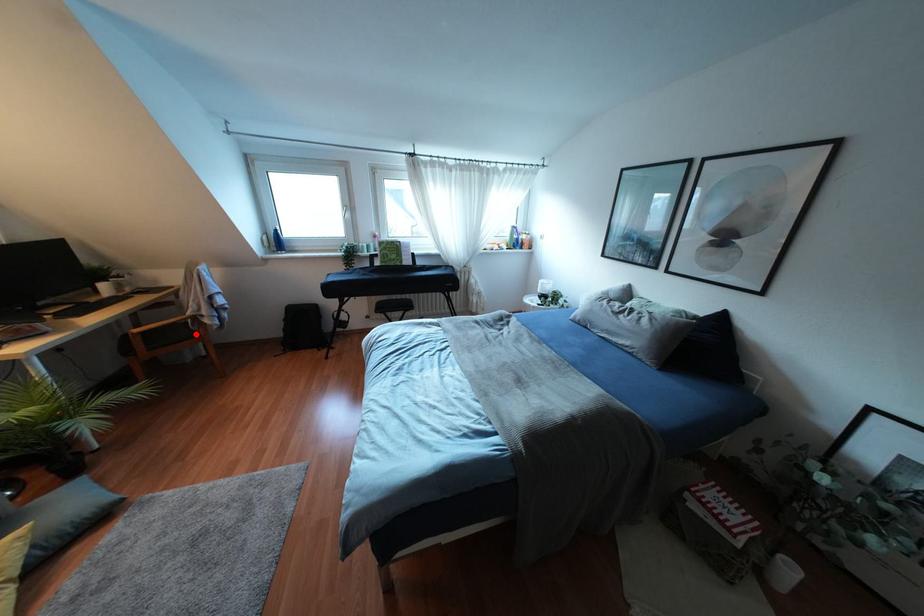
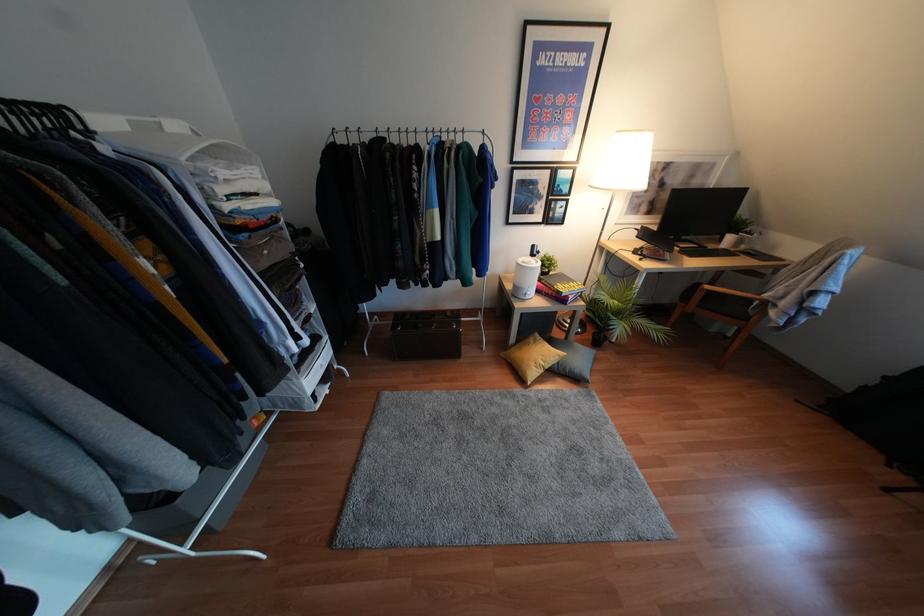
Question: I am providing you with two images of the same scene from different viewpoints. Image1 has a red point marked. In image2, the corresponding 3D location appears at what relative position? Reply with the corresponding letter.

Choices:
 (A) Closer
 (B) Farther

Answer: (A)